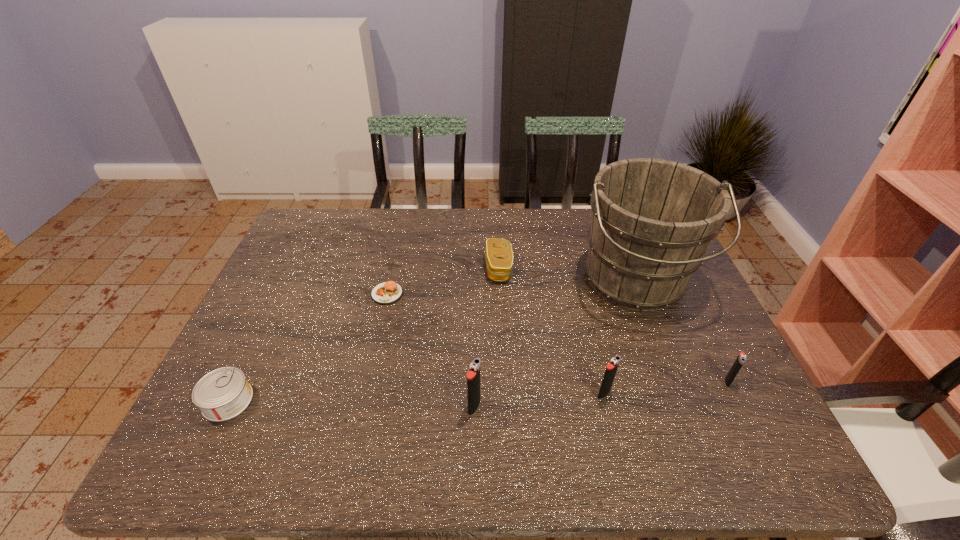
I want to click on vacant space at the near edge, so click(x=304, y=396).

Find the location of `vacant area at the left edge of the desktop`. vacant area at the left edge of the desktop is located at coordinates (265, 293).

At what (x,y) coordinates should I click in order to perform the action: click on vacant space at the right edge of the desktop. Please return your answer as a coordinate pair (x, y). Looking at the image, I should click on (670, 336).

In the image, there is a desktop. Identify the location of blank space at the far left corner. Image resolution: width=960 pixels, height=540 pixels. (300, 247).

At what (x,y) coordinates should I click in order to perform the action: click on empty location between the leftmost object and the bucket. Please return your answer as a coordinate pair (x, y). This screenshot has height=540, width=960. Looking at the image, I should click on (431, 341).

In order to click on vacant area that lies between the fourth object from left to right and the bucket in this screenshot , I will do `click(566, 275)`.

The width and height of the screenshot is (960, 540). In order to click on vacant space that's between the clutch bag and the second shortest igniter in this screenshot , I will do `click(551, 331)`.

Locate an element on the screen. The image size is (960, 540). free spot between the fourth tallest object and the second tallest igniter is located at coordinates (665, 388).

The width and height of the screenshot is (960, 540). Find the location of `vacant space in between the shortest object and the tallest object`. vacant space in between the shortest object and the tallest object is located at coordinates (511, 288).

Where is `vacant space in between the sixth tallest object and the tallest object`? Image resolution: width=960 pixels, height=540 pixels. vacant space in between the sixth tallest object and the tallest object is located at coordinates (431, 341).